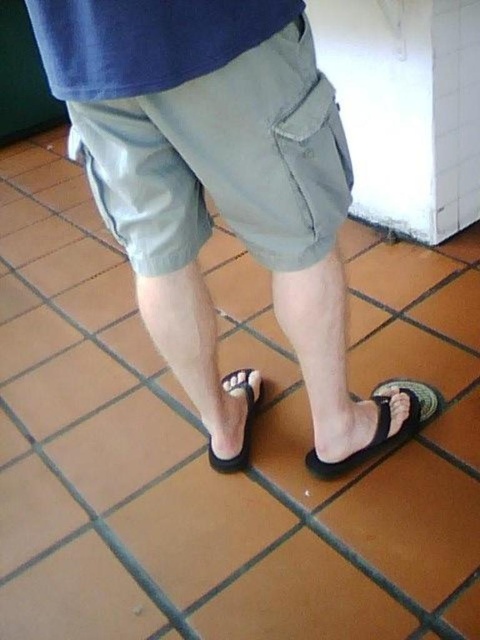
You are navigating a small robot through the room shown in the image. The robot is currently at point (x=250, y=408) and needs to reach point (x=422, y=419). According to the scene description, which direction should the robot move to get closer to its destination?

The robot should move forward because point (x=422, y=419) is in front of point (x=250, y=408).

You are a delivery robot standing at the entrance of a room with a tiled floor. You need to place a package at a specific point marked as point (x=385, y=420). The robot has a height of 1.2 meters. Can the robot reach the point without tilting its body?

The distance of point (x=385, y=420) from viewer is 1.03 meters. Since the robot is 1.2 meters tall, it can reach the point without tilting its body as its height exceeds the required distance.